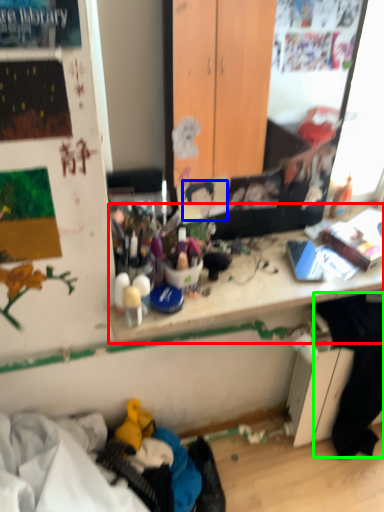
Question: Based on their relative distances, which object is nearer to writing desk (highlighted by a red box)? Choose from person (highlighted by a blue box) and clothing (highlighted by a green box).

Choices:
 (A) person
 (B) clothing

Answer: (A)